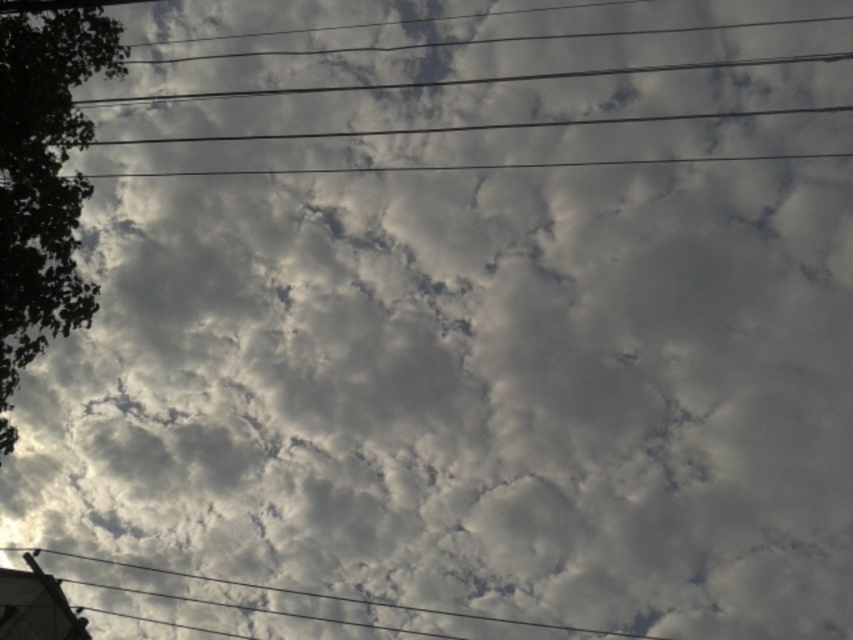
Who is higher up, green leafy tree at left or smooth gray telegraph pole at bottom left?

green leafy tree at left

Who is lower down, green leafy tree at left or smooth gray telegraph pole at bottom left?

Positioned lower is smooth gray telegraph pole at bottom left.

Image resolution: width=853 pixels, height=640 pixels. What are the coordinates of `green leafy tree at left` in the screenshot? It's located at (44, 180).

Who is more forward, (53,60) or (393,604)?

Point (53,60) is more forward.

Which is more to the right, green leafy tree at left or black wire at lower left?

black wire at lower left is more to the right.

Which is behind, point (3, 337) or point (170, 572)?

Point (170, 572)

Identify the location of green leafy tree at left. (44, 180).

Can you confirm if black wire at lower left is thinner than smooth gray telegraph pole at bottom left?

Incorrect, black wire at lower left's width is not less than smooth gray telegraph pole at bottom left's.

Can you confirm if black wire at lower left is positioned below smooth gray telegraph pole at bottom left?

Yes, black wire at lower left is below smooth gray telegraph pole at bottom left.

Who is more forward, (387, 602) or (88, 637)?

Point (88, 637) is more forward.

In order to click on black wire at lower left in this screenshot , I will do point(332,595).